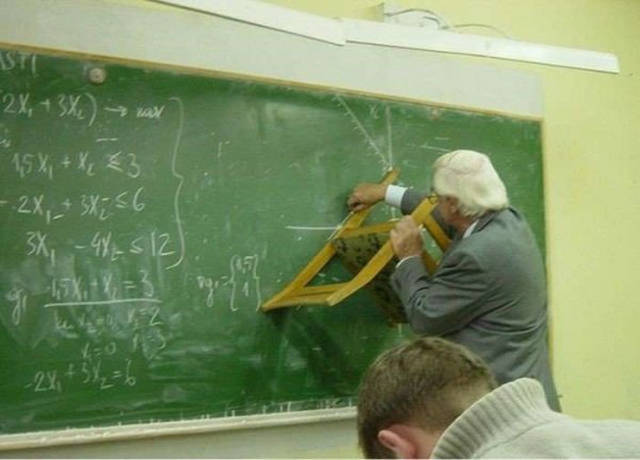
Find the location of a particular element. Image resolution: width=640 pixels, height=460 pixels. chair is located at coordinates (354, 232).